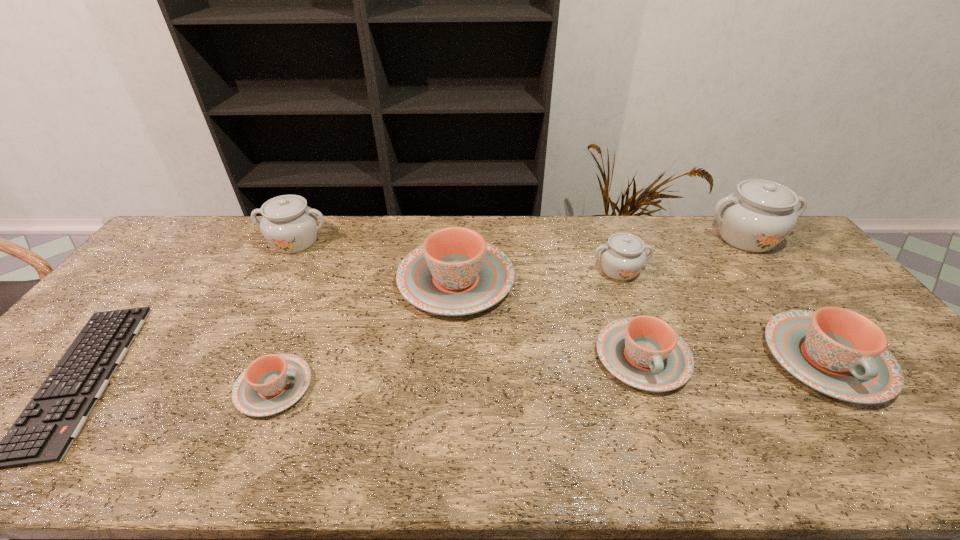
Where is `free space between the smallest white chinaware and the tallest chinaware`? The width and height of the screenshot is (960, 540). free space between the smallest white chinaware and the tallest chinaware is located at coordinates (683, 254).

Locate an element on the screen. Image resolution: width=960 pixels, height=540 pixels. empty space between the smallest white chinaware and the second biggest pink chinaware is located at coordinates (723, 314).

Find the location of `unoccupied area between the tallest chinaware and the leftmost white chinaware`. unoccupied area between the tallest chinaware and the leftmost white chinaware is located at coordinates (521, 239).

This screenshot has height=540, width=960. Find the location of `vacant space that's between the second shortest object and the sixth tallest chinaware`. vacant space that's between the second shortest object and the sixth tallest chinaware is located at coordinates (458, 372).

You are a GUI agent. You are given a task and a screenshot of the screen. Output one action in this format:
    pyautogui.click(x=<x>, y=<y>)
    Task: Click on the closest object relative to the biggest white chinaware
    This screenshot has width=960, height=540.
    Given the screenshot: What is the action you would take?
    pyautogui.click(x=622, y=257)

Locate which object is the fifth closest to the rightmost pink chinaware. Please provide its 2D coordinates. Your answer should be formatted as a tuple, i.e. [(x, y)], where the tuple contains the x and y coordinates of a point satisfying the conditions above.

[(272, 383)]

Select which chinaware appears as the second closest to the leftmost object. Please provide its 2D coordinates. Your answer should be formatted as a tuple, i.e. [(x, y)], where the tuple contains the x and y coordinates of a point satisfying the conditions above.

[(272, 383)]

Point out which chinaware is positioned as the fourth nearest to the second tallest chinaware. Please provide its 2D coordinates. Your answer should be formatted as a tuple, i.e. [(x, y)], where the tuple contains the x and y coordinates of a point satisfying the conditions above.

[(622, 257)]

Identify which white chinaware is the third closest to the seventh tallest object. Please provide its 2D coordinates. Your answer should be formatted as a tuple, i.e. [(x, y)], where the tuple contains the x and y coordinates of a point satisfying the conditions above.

[(757, 217)]

At what (x,y) coordinates should I click in order to perform the action: click on the closest white chinaware to the tallest object. Please return your answer as a coordinate pair (x, y). The image size is (960, 540). Looking at the image, I should click on (622, 257).